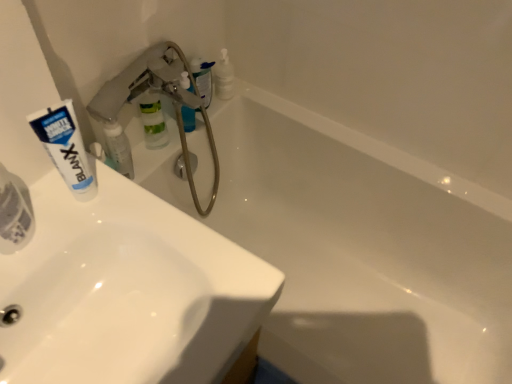
You are a GUI agent. You are given a task and a screenshot of the screen. Output one action in this format:
    pyautogui.click(x=<x>, y=<y>)
    Task: Click on the free space above white glossy sink at upper left, which is counted as the first sink, starting from the front (from a real-world perspective)
    
    Given the screenshot: What is the action you would take?
    pyautogui.click(x=82, y=244)